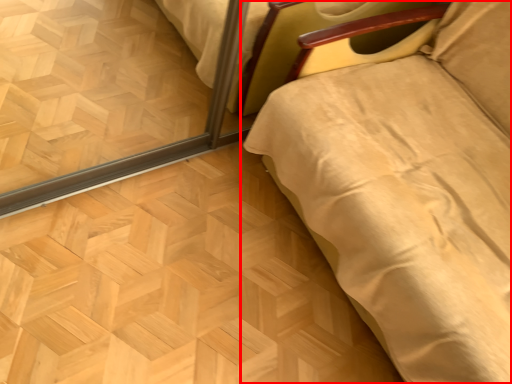
Question: From the image's perspective, where is furniture (annotated by the red box) located in relation to plywood in the image?

Choices:
 (A) above
 (B) below

Answer: (A)